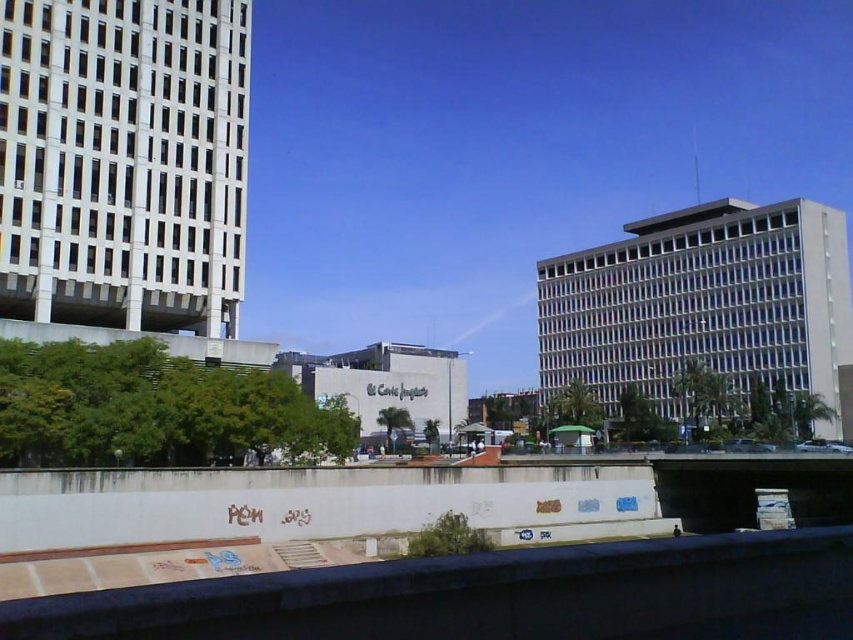
Where is `white glass building at left`? white glass building at left is located at coordinates (123, 161).

Does point (187, 109) come behind point (677, 278)?

That is False.

Find the location of a particular element. The height and width of the screenshot is (640, 853). white glass building at left is located at coordinates (123, 161).